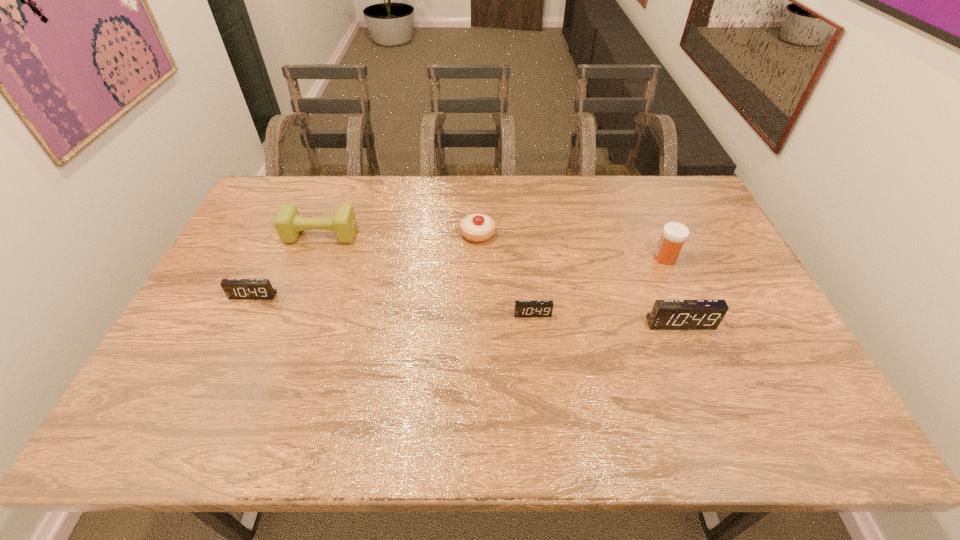
Identify the location of free space at the right edge of the desktop. (738, 357).

Where is `free space at the near left corner of the desktop`? free space at the near left corner of the desktop is located at coordinates (221, 379).

Find the location of a particular element. blank space at the far right corner of the desktop is located at coordinates (674, 180).

Where is `vacant space that is in between the dumbbell and the third object from left to right`? The width and height of the screenshot is (960, 540). vacant space that is in between the dumbbell and the third object from left to right is located at coordinates (399, 235).

Identify the location of free space between the dumbbell and the tallest alarm clock. (500, 279).

This screenshot has width=960, height=540. Identify the location of vacant region between the tallest alarm clock and the dumbbell. pyautogui.click(x=500, y=279).

Locate an element on the screen. This screenshot has width=960, height=540. free spot between the fourth nearest object and the dumbbell is located at coordinates (493, 247).

The image size is (960, 540). In order to click on free spot between the second tallest alarm clock and the rightmost alarm clock in this screenshot , I will do `click(467, 309)`.

You are a GUI agent. You are given a task and a screenshot of the screen. Output one action in this format:
    pyautogui.click(x=<x>, y=<y>)
    Task: Click on the empty location between the third farthest object and the tallest alarm clock
    
    Given the screenshot: What is the action you would take?
    pyautogui.click(x=673, y=291)

Locate an element on the screen. This screenshot has height=540, width=960. empty space between the third object from left to right and the tallest alarm clock is located at coordinates (579, 279).